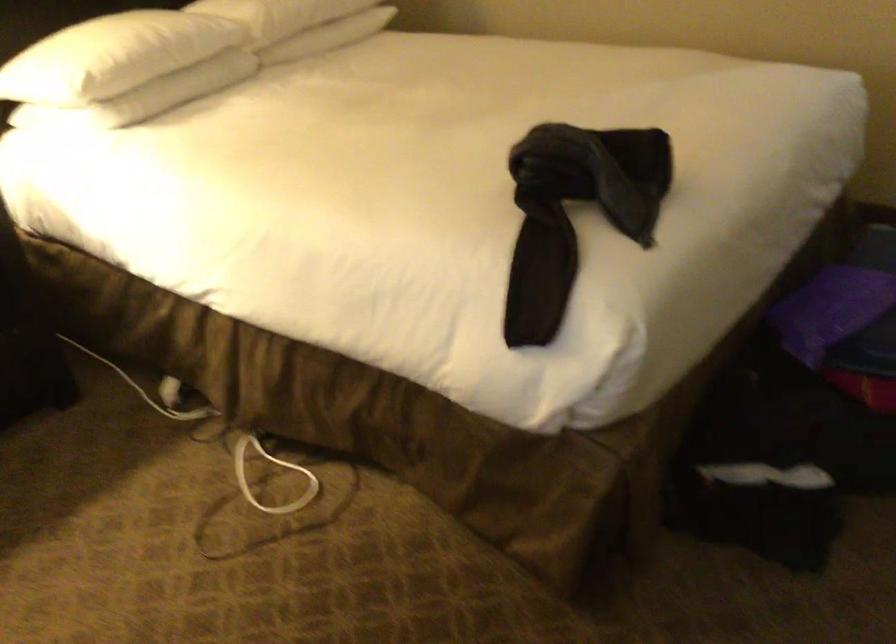
The location [574,212] corresponds to which object?

It refers to a black clothing item.